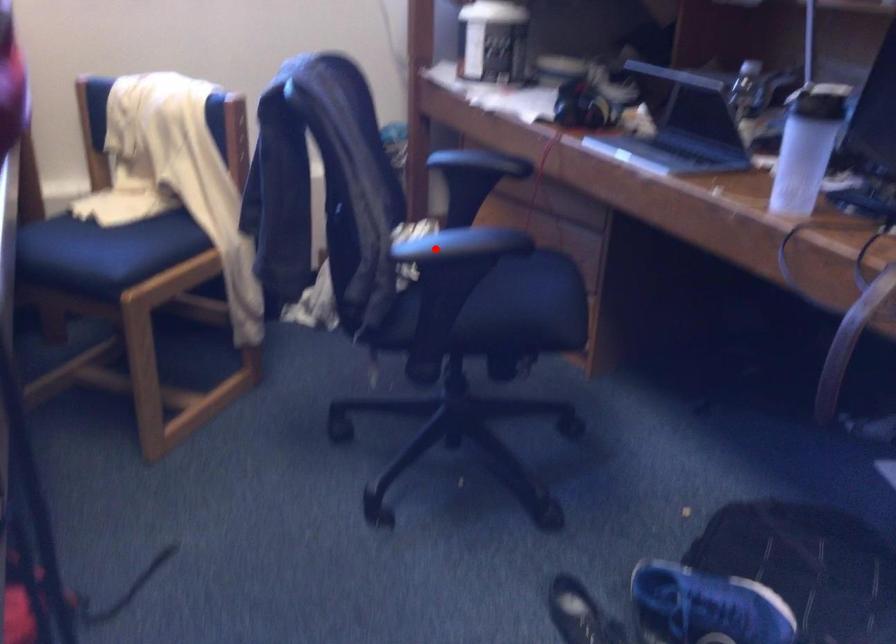
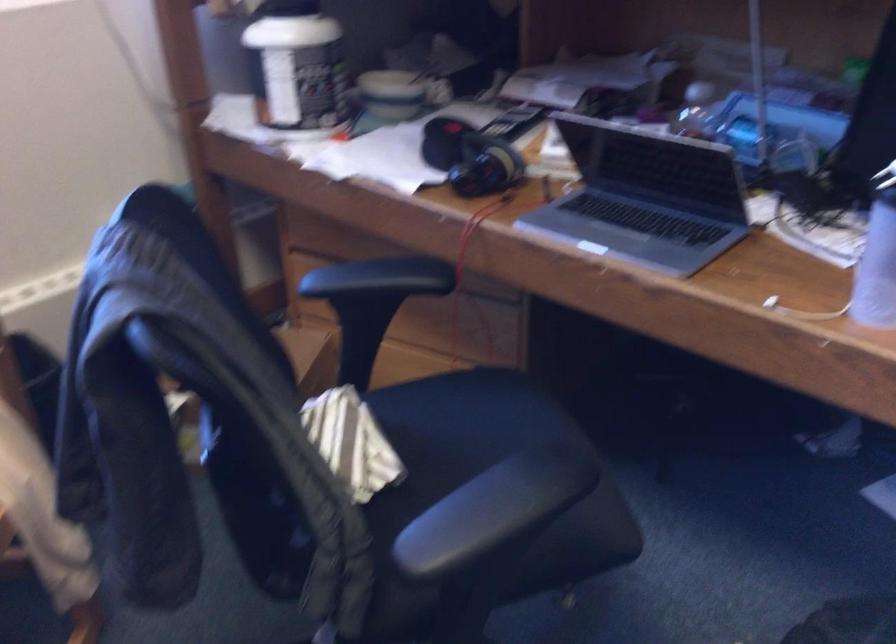
Where in the second image is the point corresponding to the highlighted location from the first image?

(471, 529)